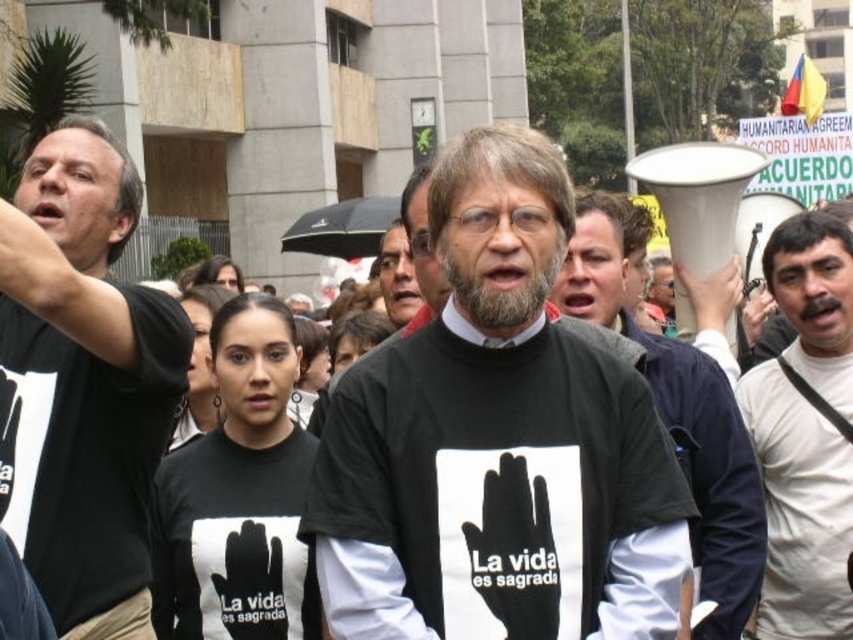
Consider the image. Which of these two, black matte t-shirt at center or black matte megaphone at center, stands taller?

black matte megaphone at center

Which is behind, point (556, 333) or point (747, 513)?

Point (747, 513)

Find the location of a particular element. This screenshot has height=640, width=853. black matte t-shirt at center is located at coordinates (497, 444).

Who is positioned more to the left, black matte t-shirt at center or white matte shirt at center?

black matte t-shirt at center

Between black matte t-shirt at center and white matte shirt at center, which one has more height?

black matte t-shirt at center

Describe the element at coordinates (497, 444) in the screenshot. I see `black matte t-shirt at center` at that location.

In order to click on black matte t-shirt at center in this screenshot , I will do `click(497, 444)`.

Which of these two, white matte shirt at center or black matte megaphone at center, stands taller?

black matte megaphone at center is taller.

Who is lower down, white matte shirt at center or black matte megaphone at center?

Positioned lower is white matte shirt at center.

I want to click on white matte shirt at center, so click(x=805, y=433).

Image resolution: width=853 pixels, height=640 pixels. What are the coordinates of `white matte shirt at center` in the screenshot? It's located at (805, 433).